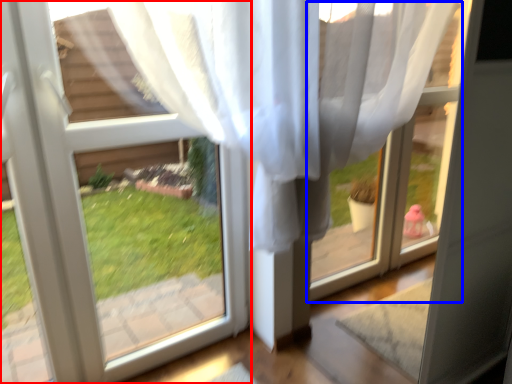
Question: Which object is closer to the camera taking this photo, window (highlighted by a red box) or window frame (highlighted by a blue box)?

Choices:
 (A) window
 (B) window frame

Answer: (B)